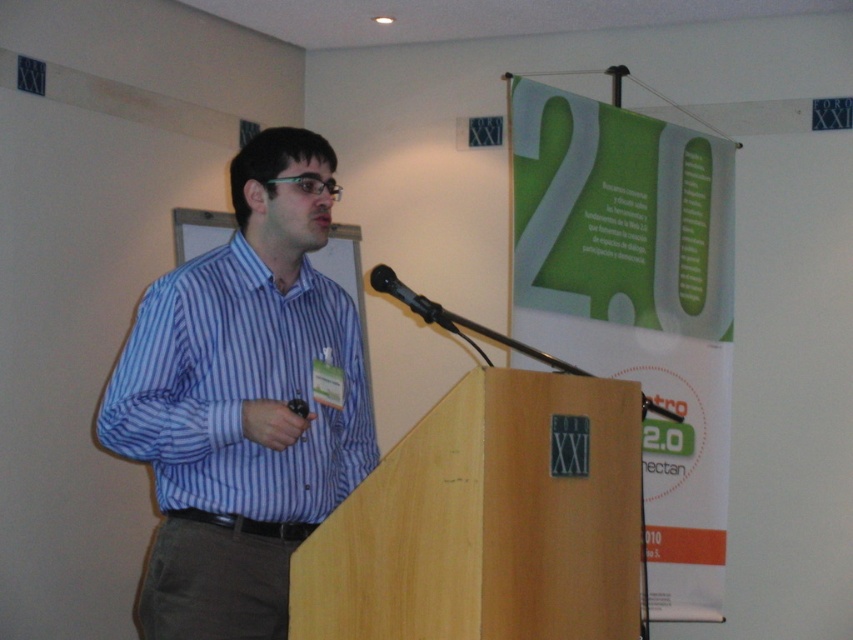
You are an event organizer who needs to ensure the speaker is properly positioned for the camera. The camera is set to focus on the black plastic microphone at center. Will the blue striped shirt at center be visible in the camera frame if the camera is focused on the microphone?

The blue striped shirt at center is to the left of black plastic microphone at center, so it will be visible in the camera frame since it is positioned next to the microphone.

You are a photographer standing 10 feet away from the speaker. You want to take a closeup photo of the blue striped shirt at center and the black plastic microphone at center. Can you focus on both objects in the same frame without moving the camera?

The distance between the blue striped shirt at center and the black plastic microphone at center is 15.88 inches. Since the depth of field at 10 feet would likely cover this small distance, you can focus on both objects in the same frame without moving the camera.

You are an event organizer who needs to ensure the speaker can be seen clearly by the audience. Given that the blue striped shirt at center and the black plastic microphone at center are both in the center, which one is more likely to distract the audience due to its size?

The blue striped shirt at center has a larger size compared to the black plastic microphone at center, so it is more likely to distract the audience due to its size.